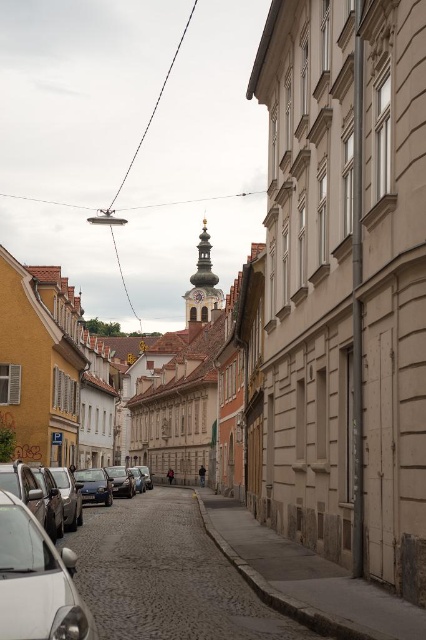
Is point (62, 620) positioned in front of point (97, 499)?

Yes, it is.

Image resolution: width=426 pixels, height=640 pixels. Find the location of `silver metallic car at lower left`. silver metallic car at lower left is located at coordinates (37, 580).

Can you confirm if smooth cobblestone alley at center is positioned to the left of shiny blue sedan at center-left?

Incorrect, smooth cobblestone alley at center is not on the left side of shiny blue sedan at center-left.

Can you confirm if smooth cobblestone alley at center is taller than shiny blue sedan at center-left?

Yes.

Is point (144, 545) less distant than point (75, 483)?

Yes, point (144, 545) is in front of point (75, 483).

Identify the location of smooth cobblestone alley at center. (166, 576).

Is point (170, 600) behind point (8, 506)?

Yes, it is behind point (8, 506).

Between point (157, 600) and point (29, 541), which one is positioned behind?

The point (157, 600) is more distant.

Which is in front, point (175, 634) or point (0, 566)?

Point (0, 566) is in front.

Identify the location of smooth cobblestone alley at center. Image resolution: width=426 pixels, height=640 pixels. (166, 576).